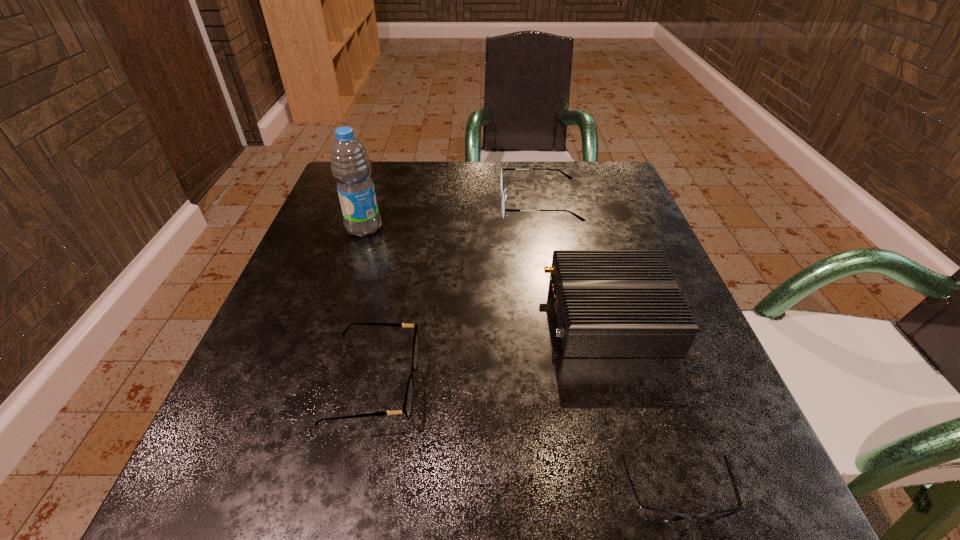
Identify the location of object present at the near right corner. Image resolution: width=960 pixels, height=540 pixels. (658, 515).

This screenshot has height=540, width=960. Identify the location of free space at the far edge of the desktop. point(551,195).

At what (x,y) coordinates should I click in order to perform the action: click on free spot at the near edge of the desktop. Please return your answer as a coordinate pair (x, y). Looking at the image, I should click on (589, 488).

This screenshot has height=540, width=960. I want to click on vacant region at the left edge of the desktop, so click(323, 265).

The height and width of the screenshot is (540, 960). I want to click on free space at the right edge, so click(x=711, y=375).

The image size is (960, 540). Find the location of `free space at the far left corner of the desktop`. free space at the far left corner of the desktop is located at coordinates (320, 210).

Locate an element on the screen. vacant space at the far right corner of the desktop is located at coordinates (605, 191).

Find the location of `vacant area between the second nearest spectacles and the router`. vacant area between the second nearest spectacles and the router is located at coordinates (492, 349).

This screenshot has width=960, height=540. I want to click on free area in between the nearest object and the water bottle, so click(519, 363).

This screenshot has width=960, height=540. Find the location of `blank region between the tallest object and the router`. blank region between the tallest object and the router is located at coordinates (487, 271).